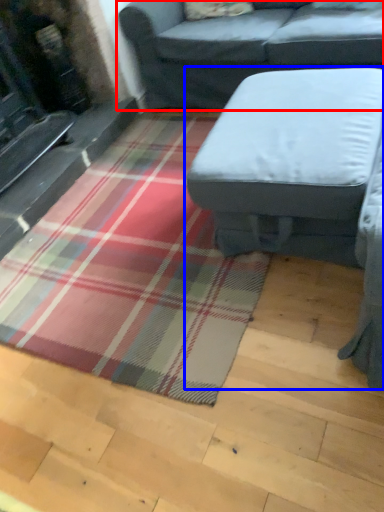
Question: Which object is closer to the camera taking this photo, studio couch (highlighted by a red box) or studio couch (highlighted by a blue box)?

Choices:
 (A) studio couch
 (B) studio couch

Answer: (B)